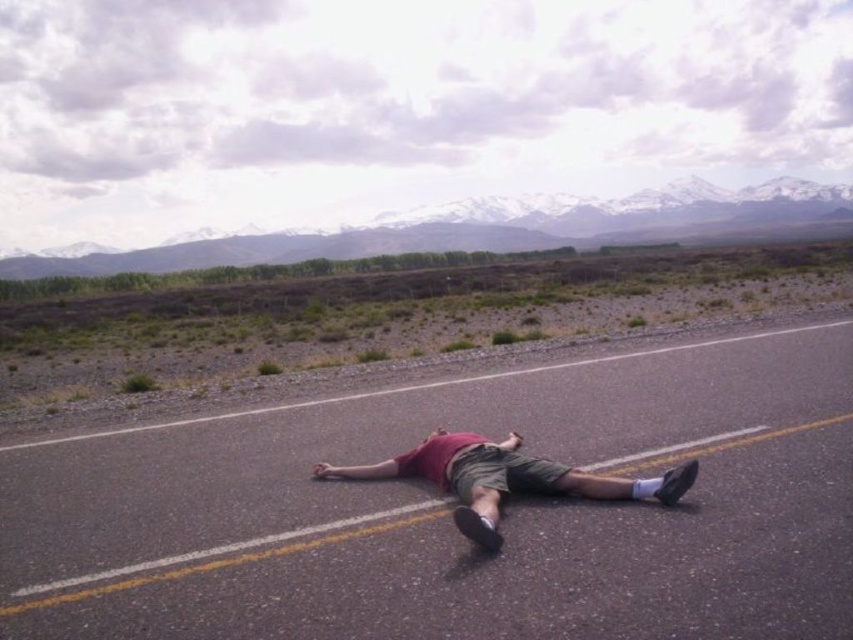
Question: Which point is closer to the camera?

Choices:
 (A) (689, 468)
 (B) (799, 500)

Answer: (A)

Question: Does black asphalt highway at center appear on the right side of matte red shirt at center?

Choices:
 (A) yes
 (B) no

Answer: (A)

Question: Which point is closer to the camera?

Choices:
 (A) (805, 444)
 (B) (469, 460)

Answer: (B)

Question: Can you confirm if black asphalt highway at center is positioned above matte red shirt at center?

Choices:
 (A) no
 (B) yes

Answer: (A)

Question: Is black asphalt highway at center smaller than matte red shirt at center?

Choices:
 (A) yes
 (B) no

Answer: (B)